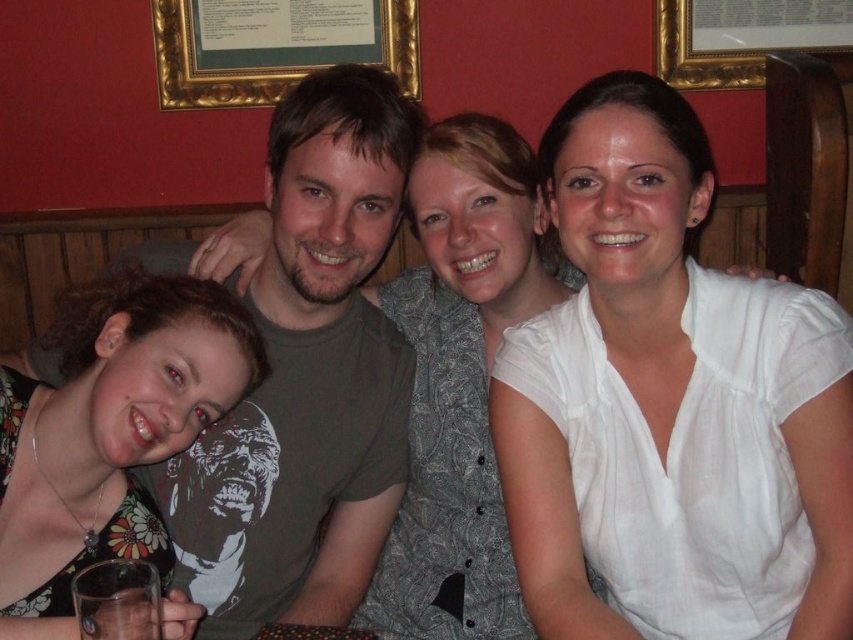
You are a photographer trying to capture a candid shot of the clear glass at lower left without including the floral print dress at lower left. Based on their positions, is this possible?

The floral print dress at lower left is positioned on the left side of clear glass at lower left, so moving the camera to the right side of the glass would allow capturing the glass without the dress.

You are a photographer trying to capture a candid shot of the group. You notice the floral print dress at lower left and the clear glass at lower left. Which object should you focus on to ensure it appears larger in the photo?

The floral print dress at lower left is much taller than the clear glass at lower left, so focusing on the floral print dress at lower left will make it appear larger in the photo.